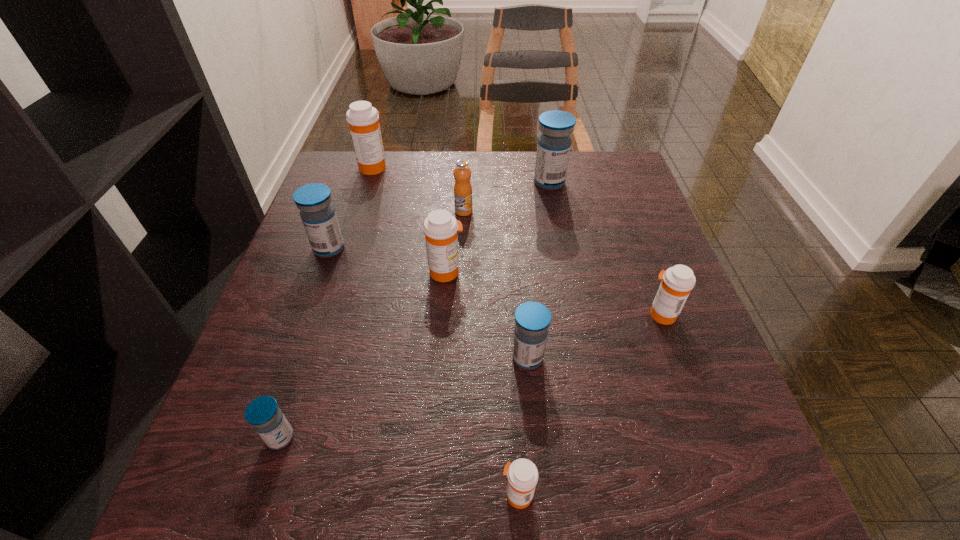
Image resolution: width=960 pixels, height=540 pixels. Find the location of `free space located 0.320m on the front of the third nearest blue medicine`. free space located 0.320m on the front of the third nearest blue medicine is located at coordinates (279, 389).

At what (x,y) coordinates should I click in order to perform the action: click on vacant area located on the front label of the orange juice. Please return your answer as a coordinate pair (x, y). Looking at the image, I should click on (462, 253).

Where is `free location located on the right of the sixth farthest medicine`? This screenshot has height=540, width=960. free location located on the right of the sixth farthest medicine is located at coordinates (633, 357).

This screenshot has height=540, width=960. Find the location of `vacant space located on the left of the sixth farthest object`. vacant space located on the left of the sixth farthest object is located at coordinates (503, 314).

Find the location of a particular element. This screenshot has width=960, height=540. vacant space located 0.120m on the back of the eighth farthest object is located at coordinates (305, 361).

Locate an element on the screen. vacant area situated on the right of the third orange medicine from left to right is located at coordinates (617, 495).

Image resolution: width=960 pixels, height=540 pixels. In order to click on object at the near edge in this screenshot , I will do `click(522, 474)`.

You are a GUI agent. You are given a task and a screenshot of the screen. Output one action in this format:
    pyautogui.click(x=<x>, y=<y>)
    Task: Click on the object situated at the right edge
    The image size is (960, 540).
    Given the screenshot: What is the action you would take?
    pyautogui.click(x=677, y=282)

This screenshot has width=960, height=540. In order to click on object that is at the far left corner in this screenshot , I will do `click(362, 118)`.

Identify the location of free spot at the far edge of the desktop. tap(524, 170).